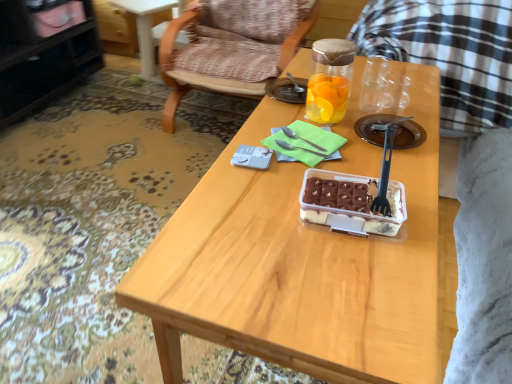
The width and height of the screenshot is (512, 384). What are the coordinates of `free spot in front of satin silver fork at center, the second fork in the front-to-back sequence` in the screenshot? It's located at (286, 182).